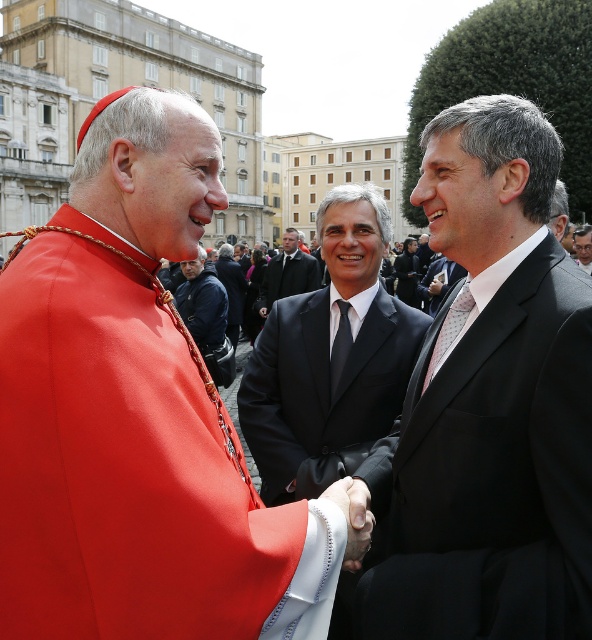
You are standing in the scene and want to take a photo of the person in the red cassock and the person in the dark suit. The point marked at coordinates point (27, 508) is where you need to position yourself to capture both individuals in the frame. Is this point far enough away to include both people in the photo?

The point marked at coordinates point (27, 508) is 104.11 feet away from the viewer. This distance should be sufficient to include both the person in the red cassock and the person in the dark suit in the photo, as they are positioned close to each other in the scene.